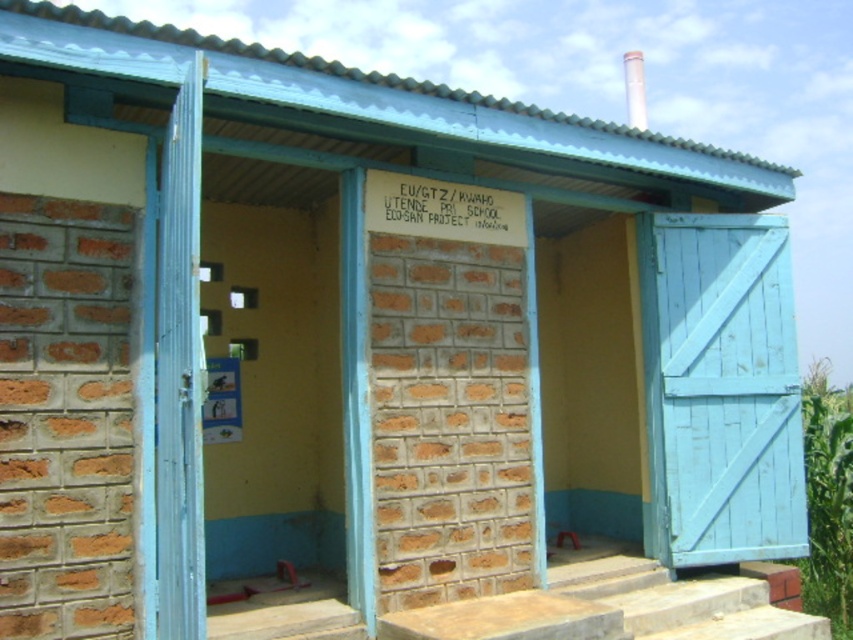
Who is higher up, blue painted wood door at left or concrete steps at center?

blue painted wood door at left

Identify the location of blue painted wood door at left. click(x=180, y=371).

This screenshot has height=640, width=853. Identify the location of blue painted wood door at left. (180, 371).

Which is behind, point (805, 618) or point (846, 502)?

Positioned behind is point (846, 502).

Which is more to the left, concrete steps at center or green leafy corn at right?

Positioned to the left is concrete steps at center.

Does point (822, 624) come closer to viewer compared to point (833, 604)?

Yes, it is in front of point (833, 604).

Image resolution: width=853 pixels, height=640 pixels. Identify the location of concrete steps at center. (677, 598).

Who is taller, blue painted wood door at left or green leafy corn at right?

blue painted wood door at left is taller.

How far apart are blue painted wood door at left and green leafy corn at right?

A distance of 4.97 meters exists between blue painted wood door at left and green leafy corn at right.

Who is more forward, [167,284] or [843,602]?

Point [167,284] is in front.

Where is `blue painted wood door at left`? Image resolution: width=853 pixels, height=640 pixels. blue painted wood door at left is located at coordinates 180,371.